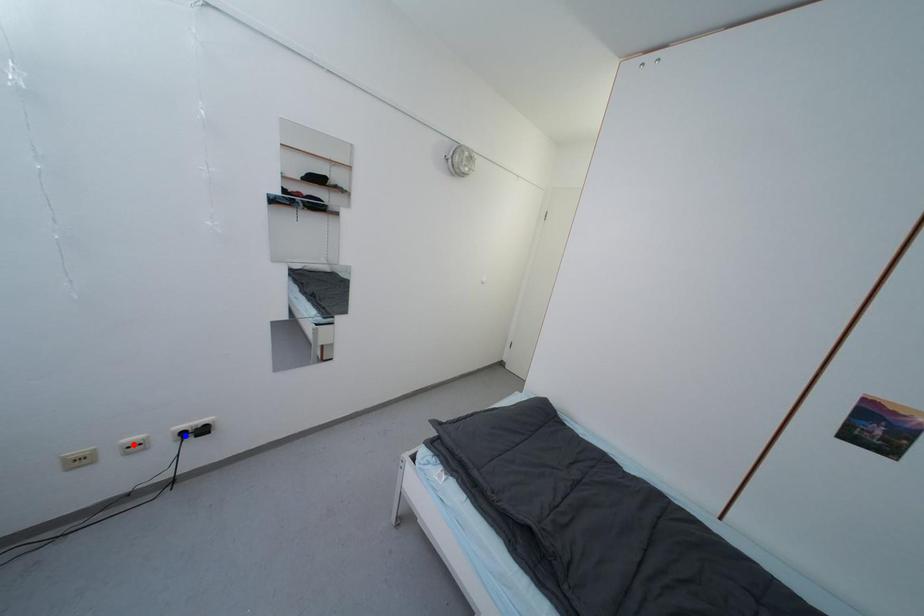
Question: In the image, two points are highlighted. Which point is nearer to the camera? Reply with the corresponding letter.

Choices:
 (A) blue point
 (B) red point

Answer: (B)